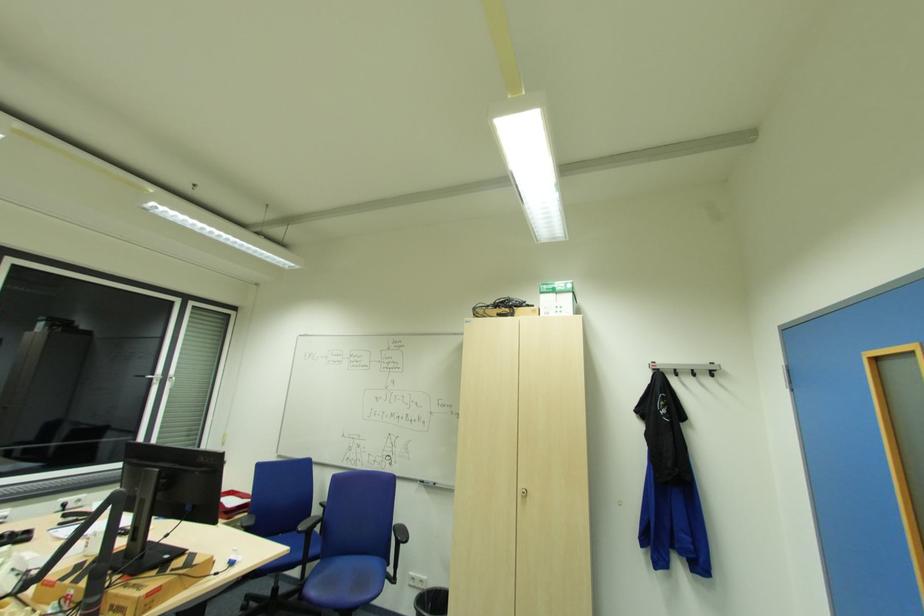
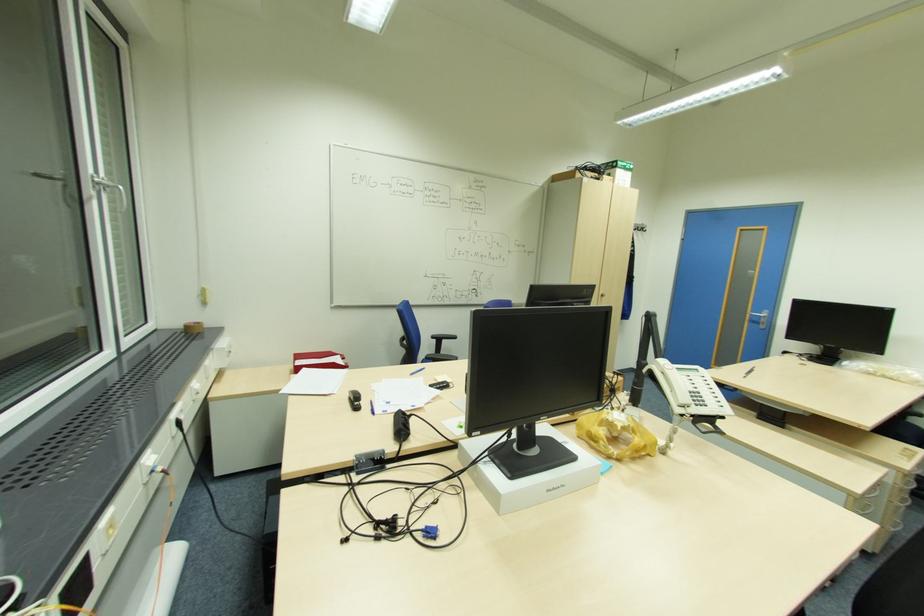
Find the pixel in the second image that matches [527,493] in the first image.

(604, 294)